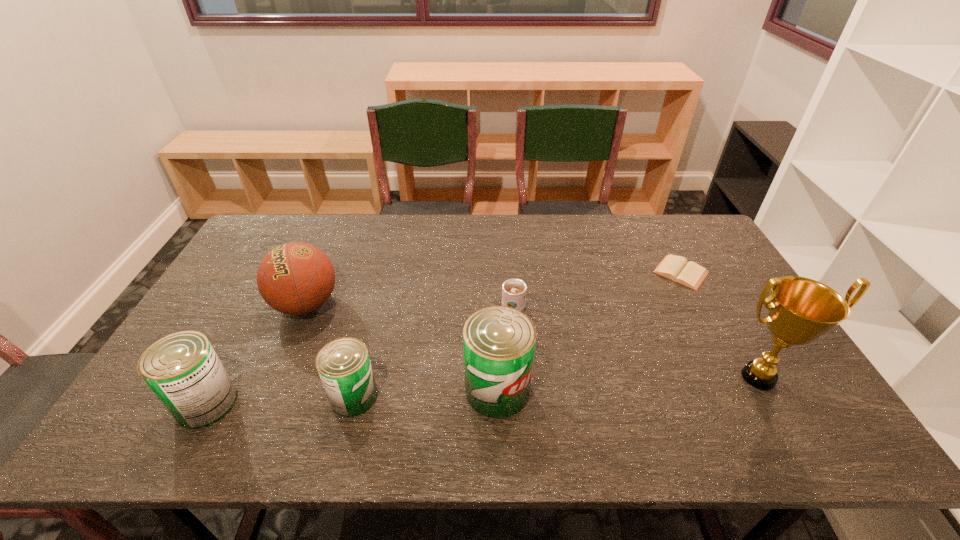
Image resolution: width=960 pixels, height=540 pixels. In order to click on object that is the fifth closest to the second can from right to left in this screenshot , I will do `click(800, 310)`.

Find the location of a particular element. the second closest object to the diary is located at coordinates (513, 290).

Locate which can is the second closest to the rightmost can. Please provide its 2D coordinates. Your answer should be formatted as a tuple, i.e. [(x, y)], where the tuple contains the x and y coordinates of a point satisfying the conditions above.

[(183, 370)]

Locate which can ranks second in proximity to the second tallest can. Please provide its 2D coordinates. Your answer should be formatted as a tuple, i.e. [(x, y)], where the tuple contains the x and y coordinates of a point satisfying the conditions above.

[(499, 342)]

Identify the location of free location that satisfies the following two spatial constraints: 1. on the back side of the basketball; 2. on the right side of the second shortest can. (259, 305).

Identify the location of free location that satisfies the following two spatial constraints: 1. on the back side of the diary; 2. on the left side of the basketball. (320, 272).